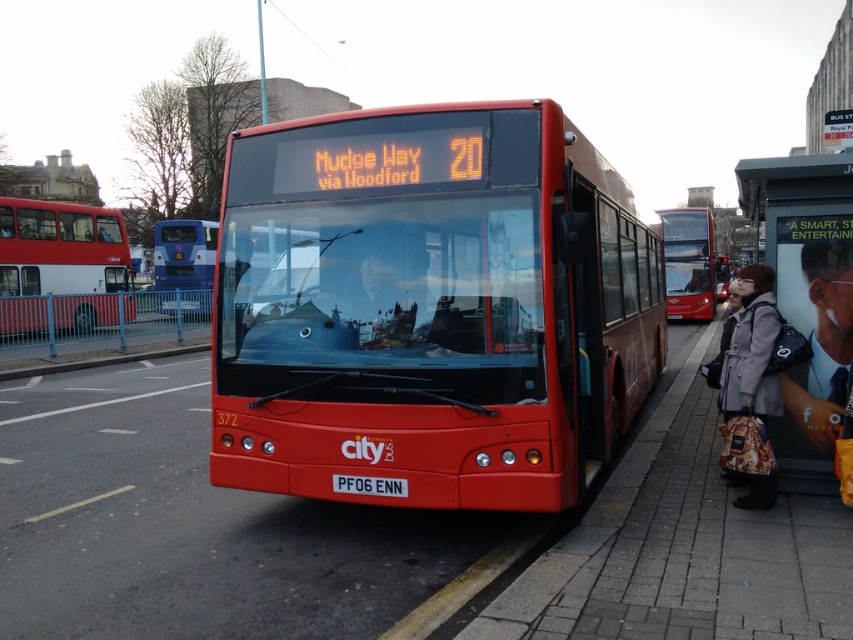
Is glossy red bus at center positioned behind white plastic license plate at center?

Yes.

Is point (181, 236) closer to camera compared to point (363, 481)?

No.

Is point (173, 228) more distant than point (357, 492)?

Yes, point (173, 228) is behind point (357, 492).

What are the coordinates of `glossy red bus at center` in the screenshot? It's located at (183, 253).

Is gray wool coat at lower right further to the viewer compared to smooth black tie at center?

No, gray wool coat at lower right is in front of smooth black tie at center.

Find the location of a particular element. The width and height of the screenshot is (853, 640). gray wool coat at lower right is located at coordinates pos(751,349).

Measure the distance between matte red bus at left and camera.

A distance of 15.20 meters exists between matte red bus at left and camera.

Does matte red bus at left have a lesser height compared to smooth black tie at center?

No, matte red bus at left is not shorter than smooth black tie at center.

Does point (111, 292) come in front of point (814, 406)?

No, (111, 292) is further to viewer.

I want to click on matte red bus at left, so click(x=61, y=266).